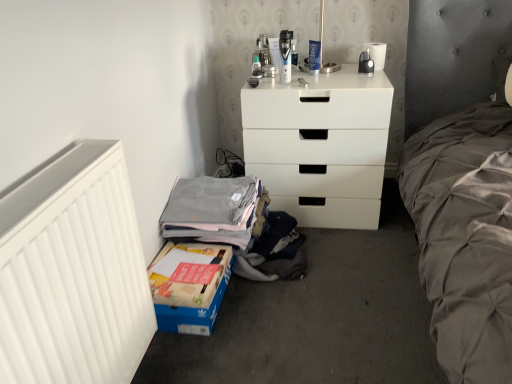
Question: Is the depth of white matte radiator at left less than that of matte plastic shaver at upper center?

Choices:
 (A) yes
 (B) no

Answer: (A)

Question: Is matte plastic shaver at upper center at the back of white matte radiator at left?

Choices:
 (A) yes
 (B) no

Answer: (B)

Question: Is the position of white matte radiator at left more distant than that of matte plastic shaver at upper center?

Choices:
 (A) yes
 (B) no

Answer: (B)

Question: From a real-world perspective, is white matte radiator at left positioned under matte plastic shaver at upper center based on gravity?

Choices:
 (A) no
 (B) yes

Answer: (B)

Question: Does white matte radiator at left have a lesser width compared to matte plastic shaver at upper center?

Choices:
 (A) no
 (B) yes

Answer: (A)

Question: Can you confirm if white matte radiator at left is shorter than matte plastic shaver at upper center?

Choices:
 (A) no
 (B) yes

Answer: (A)

Question: From a real-world perspective, is white matte chest of drawers at center under gray cotton shirt at lower left?

Choices:
 (A) yes
 (B) no

Answer: (B)

Question: Is white matte chest of drawers at center facing away from gray cotton shirt at lower left?

Choices:
 (A) yes
 (B) no

Answer: (B)

Question: Can you confirm if white matte chest of drawers at center is bigger than gray cotton shirt at lower left?

Choices:
 (A) yes
 (B) no

Answer: (A)

Question: Is white matte chest of drawers at center thinner than gray cotton shirt at lower left?

Choices:
 (A) yes
 (B) no

Answer: (B)

Question: Is gray cotton shirt at lower left completely or partially inside white matte chest of drawers at center?

Choices:
 (A) no
 (B) yes

Answer: (A)

Question: Can you confirm if white matte chest of drawers at center is wider than gray cotton shirt at lower left?

Choices:
 (A) yes
 (B) no

Answer: (A)

Question: Is white matte chest of drawers at center positioned in front of white matte radiator at left?

Choices:
 (A) yes
 (B) no

Answer: (B)